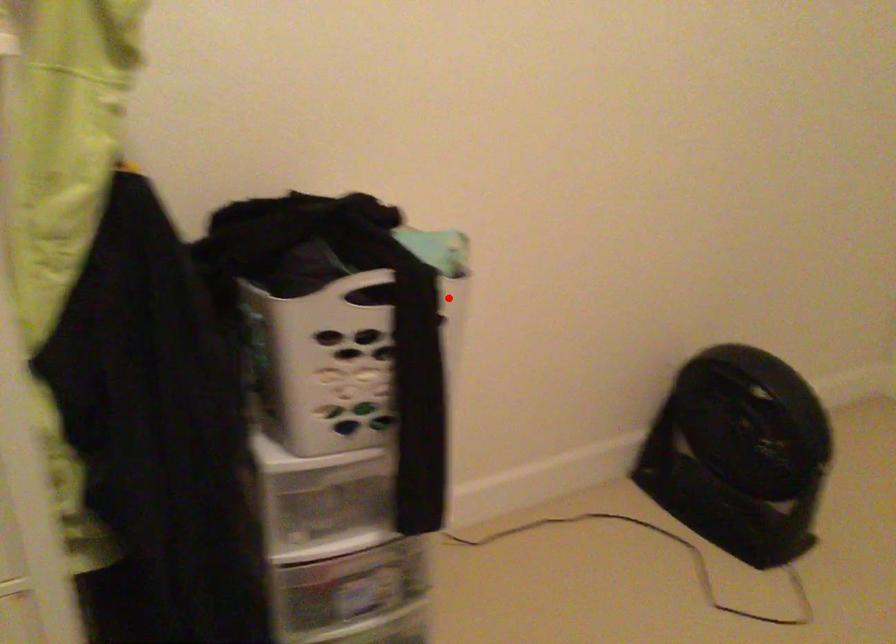
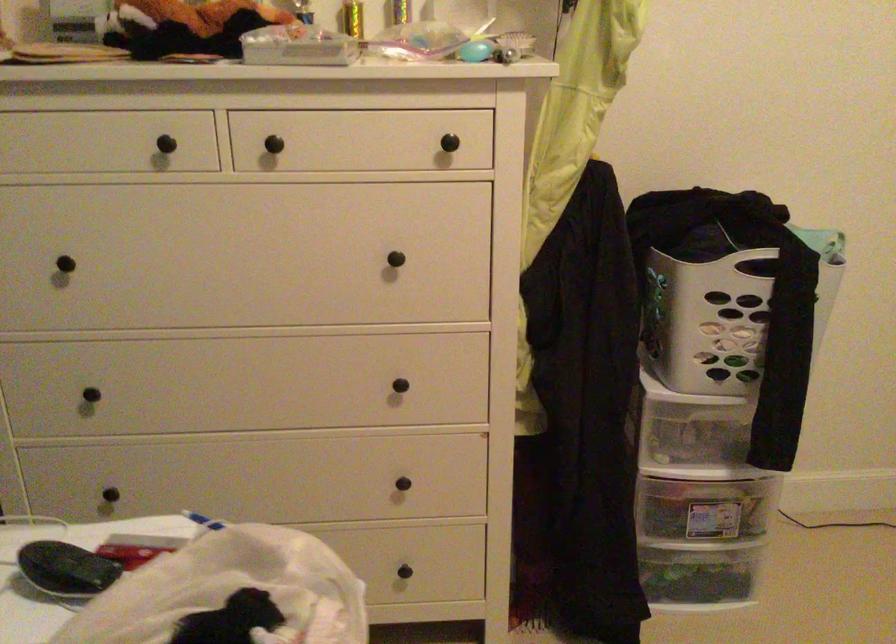
Question: I am providing you with two images of the same scene from different viewpoints. A red point is shown in image1. For the corresponding object point in image2, is it positioned nearer or farther from the camera?

Choices:
 (A) Nearer
 (B) Farther

Answer: (B)